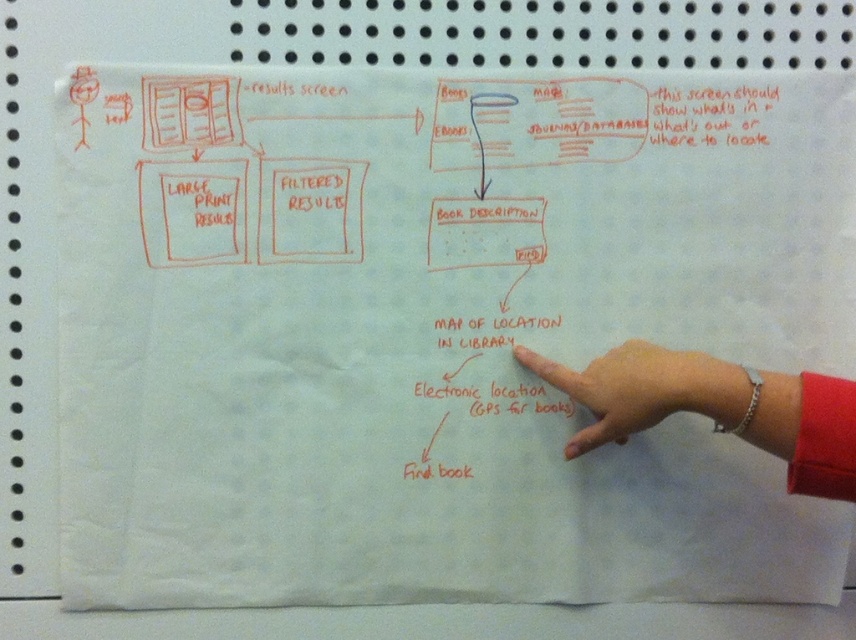
Can you confirm if silver bracelet at lower right is positioned to the right of white skin at center?

Yes, silver bracelet at lower right is to the right of white skin at center.

Who is taller, silver bracelet at lower right or white skin at center?

With more height is silver bracelet at lower right.

From the picture: Who is more forward, (599, 390) or (581, 400)?

Point (599, 390) is more forward.

Locate an element on the screen. Image resolution: width=856 pixels, height=640 pixels. silver bracelet at lower right is located at coordinates (716, 406).

Is silver bracelet at lower right bigger than matte red book description at center?

Yes, silver bracelet at lower right is bigger than matte red book description at center.

Can you confirm if silver bracelet at lower right is taller than matte red book description at center?

Yes.

Find the location of a particular element. silver bracelet at lower right is located at coordinates [x=716, y=406].

Image resolution: width=856 pixels, height=640 pixels. I want to click on silver bracelet at lower right, so click(716, 406).

What do you see at coordinates (643, 388) in the screenshot?
I see `white skin at center` at bounding box center [643, 388].

Who is taller, white skin at center or matte red book description at center?

With more height is white skin at center.

This screenshot has width=856, height=640. I want to click on white skin at center, so click(x=643, y=388).